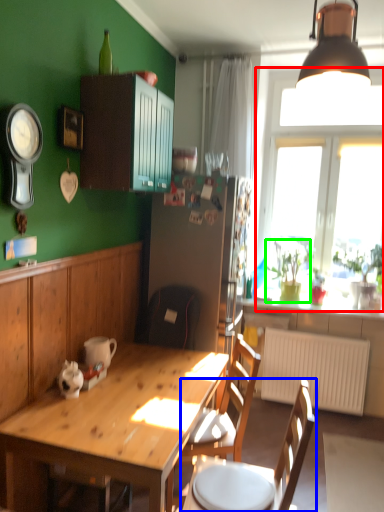
Question: Considering the real-world distances, which object is closest to window (highlighted by a red box)? chair (highlighted by a blue box) or houseplant (highlighted by a green box).

Choices:
 (A) chair
 (B) houseplant

Answer: (B)